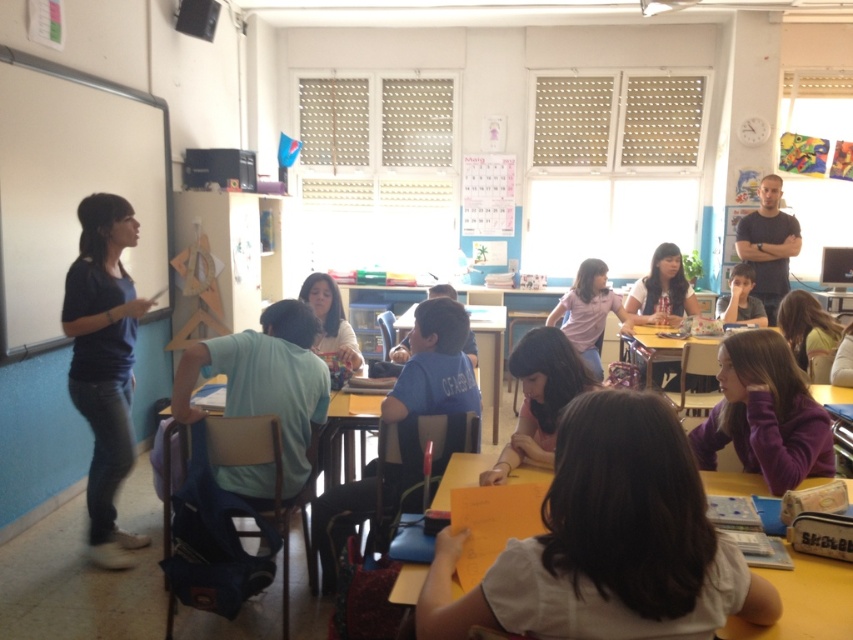
Is black t-shirt at upper right to the right of matte blue shirt at center from the viewer's perspective?

Correct, you'll find black t-shirt at upper right to the right of matte blue shirt at center.

Between black t-shirt at upper right and matte blue shirt at center, which one has less height?

With less height is matte blue shirt at center.

Is point (782, 296) farther from viewer compared to point (753, 276)?

Yes, point (782, 296) is behind point (753, 276).

The width and height of the screenshot is (853, 640). Identify the location of black t-shirt at upper right. (769, 244).

Does yellow matte table at center lie in front of matte blue shirt at center?

Yes, it is in front of matte blue shirt at center.

Does yellow matte table at center have a smaller size compared to matte blue shirt at center?

Yes, yellow matte table at center is smaller than matte blue shirt at center.

Who is more distant from viewer, (465, 480) or (734, 266)?

Point (734, 266)

You are a GUI agent. You are given a task and a screenshot of the screen. Output one action in this format:
    pyautogui.click(x=<x>, y=<y>)
    Task: Click on the yellow matte table at center
    The height and width of the screenshot is (640, 853).
    Given the screenshot: What is the action you would take?
    [x=805, y=602]

Based on the photo, is white matte board at left wider than yellow matte table at center?

No, white matte board at left is not wider than yellow matte table at center.

Does white matte board at left lie in front of yellow matte table at center?

No.

Identify the location of white matte board at left. Image resolution: width=853 pixels, height=640 pixels. (71, 186).